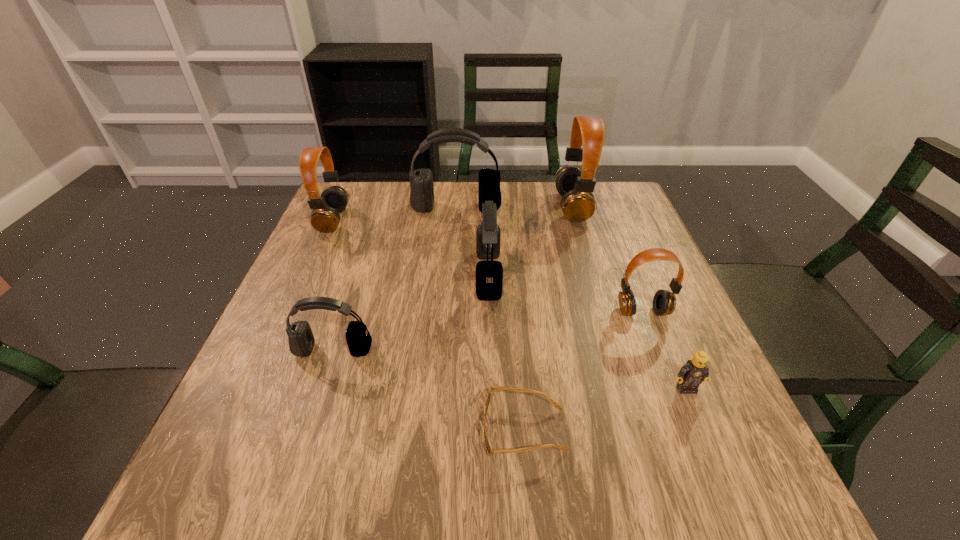
Where is `unoccupied position between the third nearest object and the biggest black headset`? This screenshot has width=960, height=540. unoccupied position between the third nearest object and the biggest black headset is located at coordinates (395, 279).

Locate an element on the screen. This screenshot has height=540, width=960. vacant area that lies between the second biggest black headset and the biggest brown headset is located at coordinates (530, 241).

Identify the location of free spot between the smallest brown headset and the second farthest black headset. The height and width of the screenshot is (540, 960). (565, 293).

I want to click on unoccupied position between the smallest brown headset and the biggest brown headset, so click(x=608, y=259).

The width and height of the screenshot is (960, 540). What are the coordinates of `vacant space in between the sunglasses and the Lego` in the screenshot? It's located at (605, 409).

I want to click on the seventh closest object to the second farthest black headset, so click(x=325, y=217).

Locate which object is the fifth closest to the smallest brown headset. Please provide its 2D coordinates. Your answer should be formatted as a tuple, i.e. [(x, y)], where the tuple contains the x and y coordinates of a point satisfying the conditions above.

[(421, 199)]

Where is `the second closest headset relative to the farthest black headset`? The width and height of the screenshot is (960, 540). the second closest headset relative to the farthest black headset is located at coordinates (575, 185).

In order to click on headset that stands as the closest to the biggest brown headset in this screenshot , I will do `click(421, 199)`.

Where is `the closest brown headset to the second nearest black headset`? the closest brown headset to the second nearest black headset is located at coordinates pos(575,185).